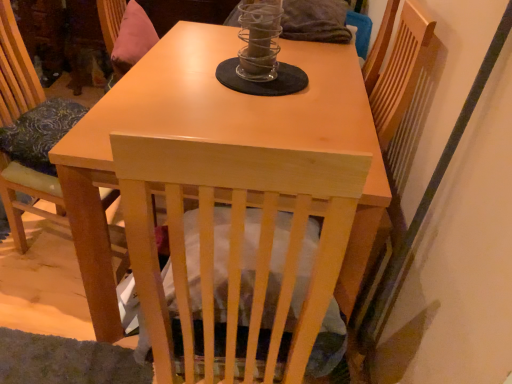
Question: Considering the relative sizes of light wood chair at left and clear glass candle holder at center in the image provided, is light wood chair at left shorter than clear glass candle holder at center?

Choices:
 (A) no
 (B) yes

Answer: (A)

Question: Is light wood chair at left completely or partially outside of clear glass candle holder at center?

Choices:
 (A) no
 (B) yes

Answer: (B)

Question: Is light wood chair at left positioned far away from clear glass candle holder at center?

Choices:
 (A) yes
 (B) no

Answer: (B)

Question: From a real-world perspective, is light wood chair at left positioned over clear glass candle holder at center based on gravity?

Choices:
 (A) no
 (B) yes

Answer: (A)

Question: Is light wood chair at left smaller than clear glass candle holder at center?

Choices:
 (A) yes
 (B) no

Answer: (B)

Question: Does light wood chair at left lie behind clear glass candle holder at center?

Choices:
 (A) yes
 (B) no

Answer: (B)

Question: Can you confirm if light wood chair at left is wider than light wood table at center?

Choices:
 (A) yes
 (B) no

Answer: (B)

Question: From the image's perspective, is light wood chair at left on light wood table at center?

Choices:
 (A) yes
 (B) no

Answer: (A)

Question: Is light wood chair at left at the left side of light wood table at center?

Choices:
 (A) yes
 (B) no

Answer: (A)

Question: From a real-world perspective, does light wood chair at left sit lower than light wood table at center?

Choices:
 (A) no
 (B) yes

Answer: (B)

Question: Is light wood chair at left positioned beyond the bounds of light wood table at center?

Choices:
 (A) no
 (B) yes

Answer: (B)

Question: Is light wood chair at left to the right of light wood table at center from the viewer's perspective?

Choices:
 (A) no
 (B) yes

Answer: (A)

Question: Is light wood table at center at the back of clear glass candle holder at center?

Choices:
 (A) yes
 (B) no

Answer: (B)